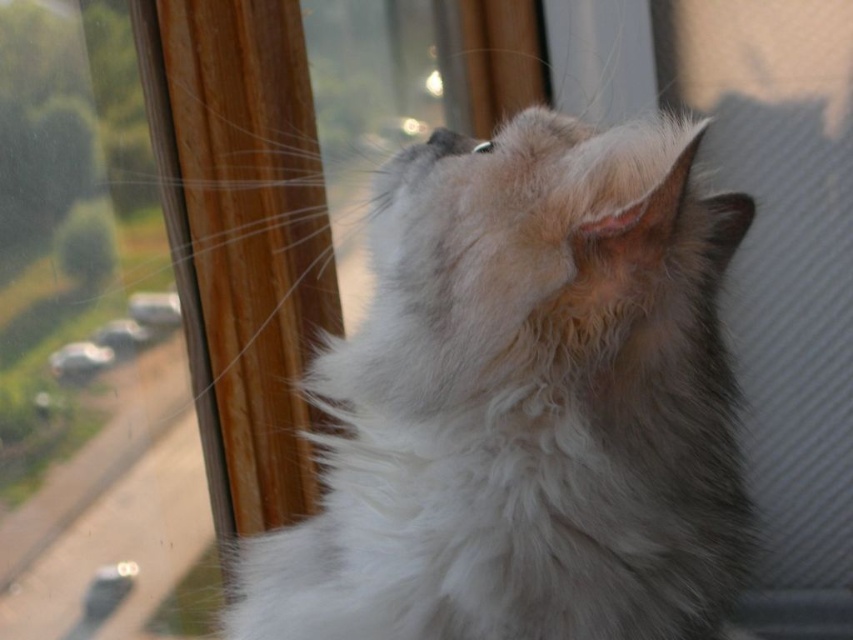
Question: Which of the following is the farthest from the observer?

Choices:
 (A) (451, 614)
 (B) (448, 148)

Answer: (B)

Question: Which point is closer to the camera?

Choices:
 (A) (552, 188)
 (B) (438, 150)

Answer: (A)

Question: Does white fluffy cat at center appear over black fur nose at center?

Choices:
 (A) no
 (B) yes

Answer: (A)

Question: Is white fluffy cat at center above black fur nose at center?

Choices:
 (A) no
 (B) yes

Answer: (A)

Question: Is white fluffy cat at center thinner than black fur nose at center?

Choices:
 (A) no
 (B) yes

Answer: (A)